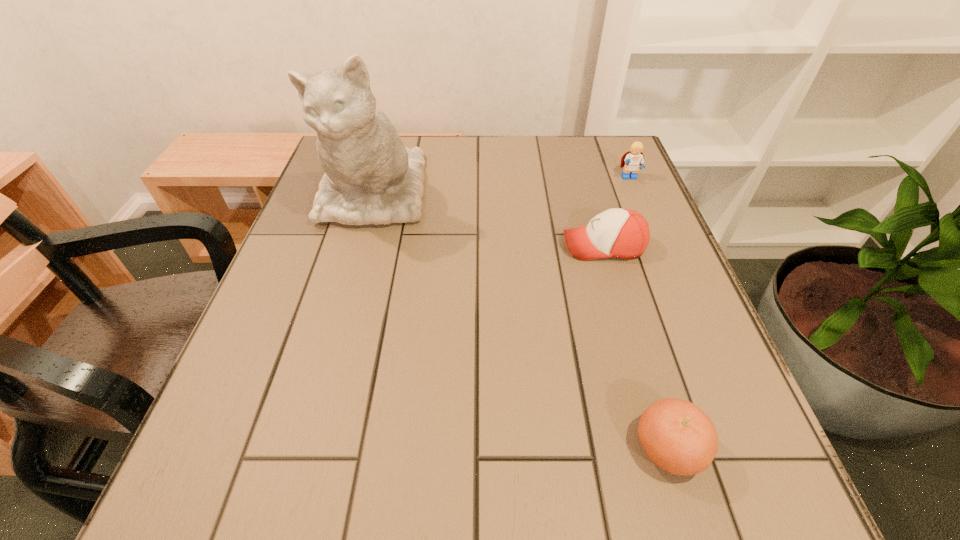
The width and height of the screenshot is (960, 540). Identify the location of object at the near right corner. (677, 436).

This screenshot has width=960, height=540. In order to click on vacant space at the far edge in this screenshot , I will do `click(448, 150)`.

Image resolution: width=960 pixels, height=540 pixels. What are the coordinates of `vacant area at the near edge of the desktop` in the screenshot? It's located at (484, 498).

Locate an element on the screen. The height and width of the screenshot is (540, 960). free region at the left edge is located at coordinates (291, 244).

What are the coordinates of `free spot at the right edge of the desktop` in the screenshot? It's located at (676, 368).

In the image, there is a desktop. Identify the location of free space at the far right corner. (602, 136).

The width and height of the screenshot is (960, 540). I want to click on vacant space at the near right corner of the desktop, so click(x=660, y=471).

Where is `free area in between the Lego and the leftmost object`? This screenshot has width=960, height=540. free area in between the Lego and the leftmost object is located at coordinates (501, 186).

This screenshot has width=960, height=540. In order to click on free space between the Lego and the clementine in this screenshot , I will do `click(649, 313)`.

Image resolution: width=960 pixels, height=540 pixels. Identify the location of free space between the nearest object and the Lego. (649, 313).